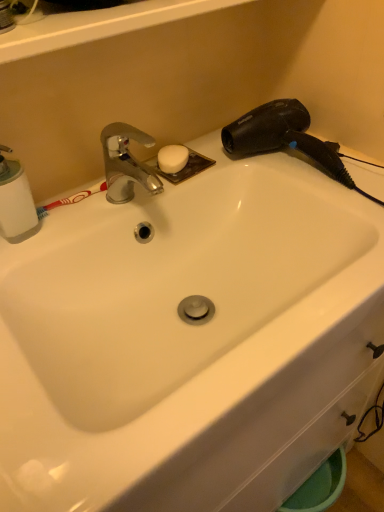
This screenshot has width=384, height=512. What do you see at coordinates (284, 138) in the screenshot?
I see `black matte hair dryer at upper right` at bounding box center [284, 138].

Find the location of a particular element. black matte hair dryer at upper right is located at coordinates (284, 138).

At what (x,y) coordinates should I click in order to perform the action: click on black matte hair dryer at upper right. Please return your answer as a coordinate pair (x, y). Looking at the image, I should click on (284, 138).